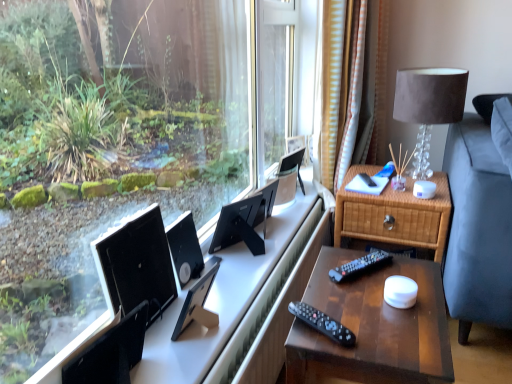
Question: From the image's perspective, is woven wood nightstand at right, which appears as the 1th nightstand when viewed from the back, over wooden nightstand at right, which is the second nightstand in back-to-front order?

Choices:
 (A) no
 (B) yes

Answer: (B)

Question: Is woven wood nightstand at right, marked as the 2th nightstand in a front-to-back arrangement, with wooden nightstand at right, acting as the first nightstand starting from the front?

Choices:
 (A) yes
 (B) no

Answer: (B)

Question: Does woven wood nightstand at right, marked as the 2th nightstand in a front-to-back arrangement, lie behind wooden nightstand at right, acting as the first nightstand starting from the front?

Choices:
 (A) yes
 (B) no

Answer: (A)

Question: Is woven wood nightstand at right, marked as the 2th nightstand in a front-to-back arrangement, not near wooden nightstand at right, which is the second nightstand in back-to-front order?

Choices:
 (A) no
 (B) yes

Answer: (A)

Question: Does woven wood nightstand at right, which appears as the 1th nightstand when viewed from the back, appear on the right side of wooden nightstand at right, which is the second nightstand in back-to-front order?

Choices:
 (A) no
 (B) yes

Answer: (B)

Question: Is woven wood nightstand at right, marked as the 2th nightstand in a front-to-back arrangement, oriented towards wooden nightstand at right, acting as the first nightstand starting from the front?

Choices:
 (A) no
 (B) yes

Answer: (B)

Question: From a real-world perspective, is satin brown lampshade at upper right over black plastic remote at right?

Choices:
 (A) no
 (B) yes

Answer: (B)

Question: From the image's perspective, is satin brown lampshade at upper right located above black plastic remote at right?

Choices:
 (A) yes
 (B) no

Answer: (A)

Question: Can you confirm if satin brown lampshade at upper right is wider than black plastic remote at right?

Choices:
 (A) yes
 (B) no

Answer: (A)

Question: From a real-world perspective, is satin brown lampshade at upper right positioned under black plastic remote at right based on gravity?

Choices:
 (A) no
 (B) yes

Answer: (A)

Question: Can we say satin brown lampshade at upper right lies outside black plastic remote at right?

Choices:
 (A) yes
 (B) no

Answer: (A)

Question: Is satin brown lampshade at upper right to the left of black plastic remote at right from the viewer's perspective?

Choices:
 (A) no
 (B) yes

Answer: (A)

Question: From a real-world perspective, does wooden nightstand at right, acting as the first nightstand starting from the front, stand above black matte computer monitor at center, which is counted as the third computer monitor, starting from the front?

Choices:
 (A) yes
 (B) no

Answer: (B)